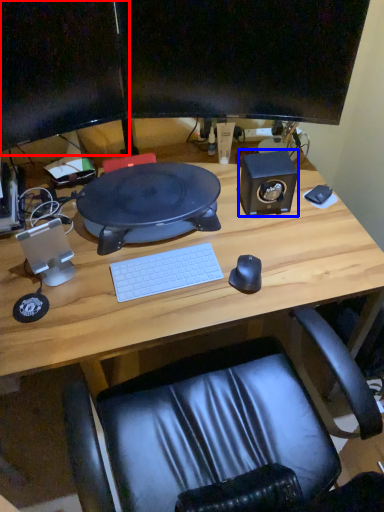
Question: Which object is further to the camera taking this photo, computer monitor (highlighted by a red box) or speaker (highlighted by a blue box)?

Choices:
 (A) computer monitor
 (B) speaker

Answer: (B)